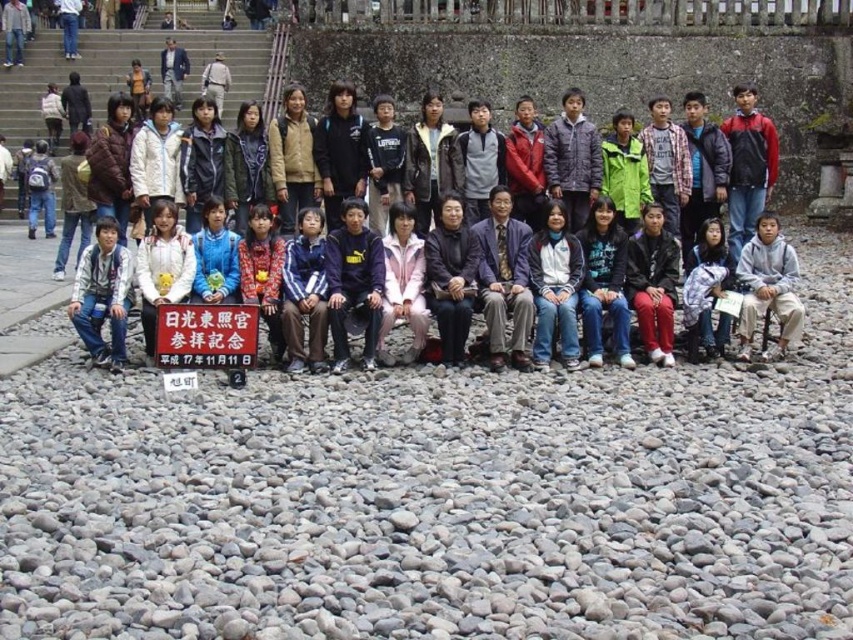
Can you confirm if gray gravel at lower center is positioned below sweatshirt at center?

Correct, gray gravel at lower center is located below sweatshirt at center.

Can you confirm if gray gravel at lower center is positioned to the right of sweatshirt at center?

Incorrect, gray gravel at lower center is not on the right side of sweatshirt at center.

Where is `gray gravel at lower center`? This screenshot has height=640, width=853. gray gravel at lower center is located at coordinates (428, 504).

Is gray gravel at lower center to the right of white paper sign at center from the viewer's perspective?

Yes, gray gravel at lower center is to the right of white paper sign at center.

Between point (737, 589) and point (225, 348), which one is positioned in front?

Positioned in front is point (737, 589).

At what (x,y) coordinates should I click in order to perform the action: click on gray gravel at lower center. Please return your answer as a coordinate pair (x, y). Looking at the image, I should click on (428, 504).

In the scene shown: Is matte black sign at center taller than sweatshirt at center?

Yes.

Consider the image. Does matte black sign at center appear on the right side of sweatshirt at center?

Incorrect, matte black sign at center is not on the right side of sweatshirt at center.

The image size is (853, 640). What do you see at coordinates (728, 168) in the screenshot? I see `matte black sign at center` at bounding box center [728, 168].

Find the location of a particular element. This screenshot has height=640, width=853. matte black sign at center is located at coordinates click(x=728, y=168).